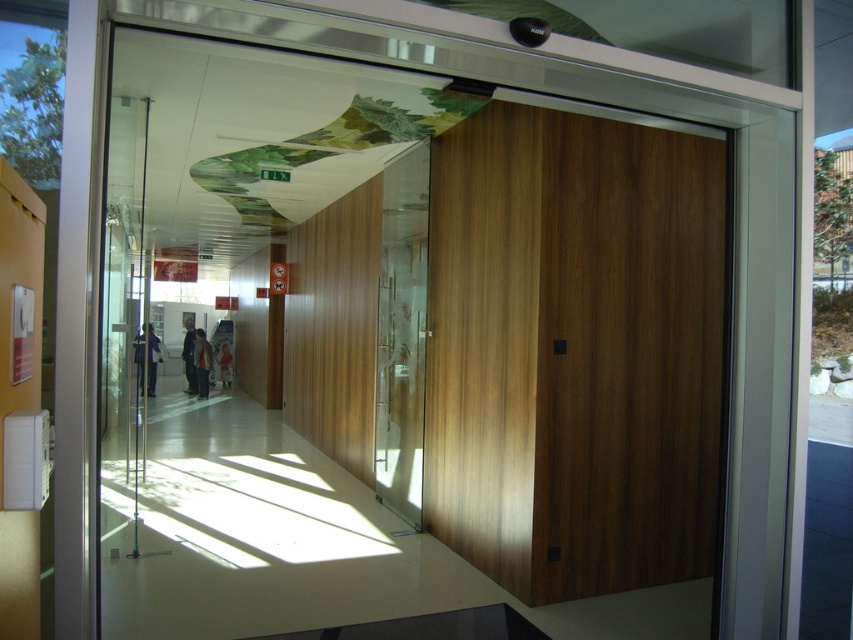
Question: Which of the following is the farthest from the observer?

Choices:
 (A) wooden door at right
 (B) dark brown leather jacket at center
 (C) dark blue jeans at center

Answer: (C)

Question: Among these points, which one is nearest to the camera?

Choices:
 (A) 194,374
 (B) 141,372

Answer: (A)

Question: Can you confirm if purple fabric at center is smaller than dark brown leather jacket at center?

Choices:
 (A) no
 (B) yes

Answer: (A)

Question: Is dark brown leather jacket at center smaller than light brown leather jacket at center?

Choices:
 (A) yes
 (B) no

Answer: (B)

Question: Can you confirm if wooden door at right is smaller than dark brown leather jacket at center?

Choices:
 (A) no
 (B) yes

Answer: (A)

Question: Which point is closer to the camera taking this photo?

Choices:
 (A) (219, 378)
 (B) (184, 340)
 (C) (149, 372)
 (D) (202, 332)

Answer: (C)